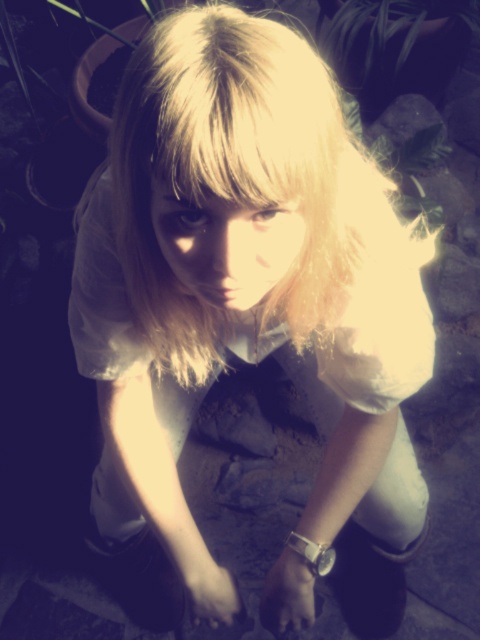
Is dark skin hand at center wider than white matte hand at lower center?

Yes.

Does dark skin hand at center have a greater height compared to white matte hand at lower center?

Yes.

The image size is (480, 640). What do you see at coordinates (288, 593) in the screenshot?
I see `dark skin hand at center` at bounding box center [288, 593].

Find the location of a particular element. The image size is (480, 640). dark skin hand at center is located at coordinates [288, 593].